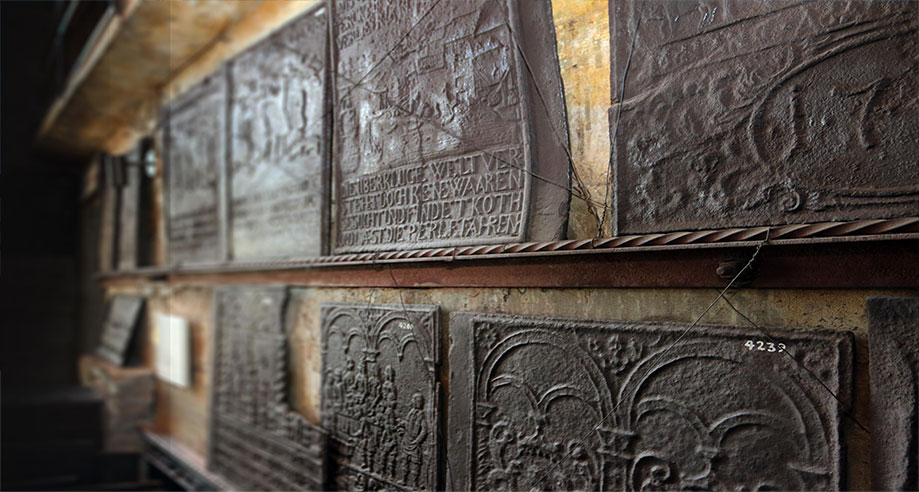
Identify the location of artifact on shelf. This screenshot has height=492, width=919. (112, 337).